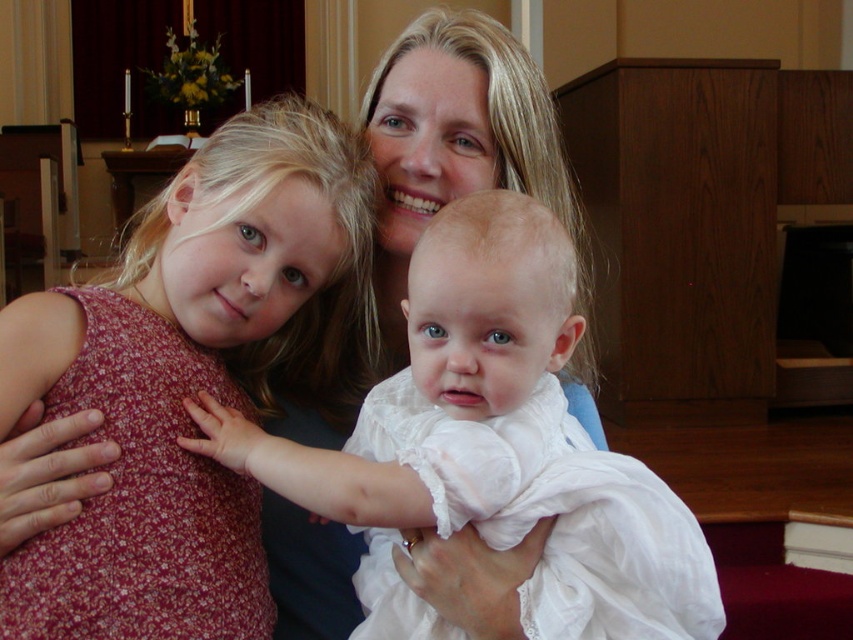
Question: Does floral fabric dress at left have a lesser width compared to white lace dress at center?

Choices:
 (A) no
 (B) yes

Answer: (B)

Question: Which point is closer to the camera taking this photo?

Choices:
 (A) [439, 634]
 (B) [354, 275]

Answer: (A)

Question: Which of the following is the closest to the observer?

Choices:
 (A) (300, 458)
 (B) (184, 598)

Answer: (B)

Question: Is floral fabric dress at left above white lace dress at center?

Choices:
 (A) no
 (B) yes

Answer: (B)

Question: Can you confirm if floral fabric dress at left is bigger than white lace dress at center?

Choices:
 (A) no
 (B) yes

Answer: (B)

Question: Which of the following is the closest to the observer?

Choices:
 (A) (553, 368)
 (B) (254, 392)

Answer: (A)